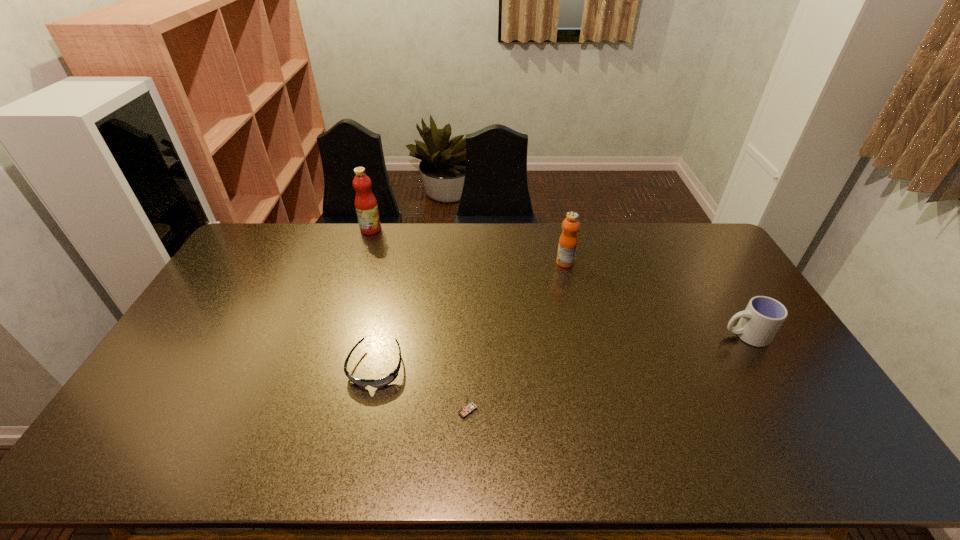
Where is `free space located on the front label of the taller fruit juice`? free space located on the front label of the taller fruit juice is located at coordinates (482, 229).

Where is `vacant region located 0.180m on the back of the fourth nearest object`? vacant region located 0.180m on the back of the fourth nearest object is located at coordinates (557, 229).

Find the location of a particular element. The width and height of the screenshot is (960, 540). free spot located with the handle on the side of the third shortest object is located at coordinates (607, 335).

The width and height of the screenshot is (960, 540). In order to click on vacant point located with the handle on the side of the third shortest object in this screenshot , I will do tap(633, 335).

You are a GUI agent. You are given a task and a screenshot of the screen. Output one action in this format:
    pyautogui.click(x=<x>, y=<y>)
    Task: Click on the vacant space located 0.180m with the handle on the side of the third shortest object
    The width and height of the screenshot is (960, 540).
    Given the screenshot: What is the action you would take?
    pyautogui.click(x=662, y=335)

Identify the location of vacant position located on the back of the matchbox. (469, 325).

Identify the location of free location located on the lenses of the fourth object from right to left. (361, 433).

Find the location of `object that is at the right edge`. object that is at the right edge is located at coordinates (760, 321).

I want to click on vacant space at the far edge of the desktop, so point(450,253).

I want to click on vacant space at the near edge of the desktop, so click(323, 439).